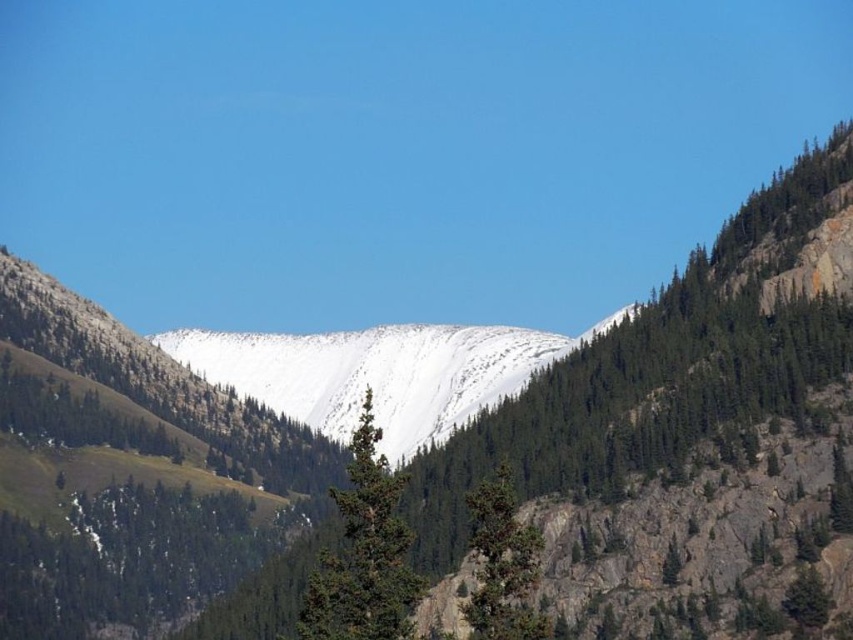
You are standing at the base of the mountain and looking towards the snow covered peak. There is a green textured tree at center. Where is the green textured tree located in relation to the snow covered peak?

The green textured tree at center is located at coordinates point (364, 554) in relation to the snow covered peak.

You are an environmental scientist assessing the mountain ecosystem. You observe the white matte snow at center and the green rough bark tree at center. Which object occupies a greater area in the scene?

The white matte snow at center is larger in size than the green rough bark tree at center, so it occupies a greater area in the scene.

You are a hiker planning to reach the snow covered peak. You have two possible paths marked by two points on your map. The first path leads from point (361, 445) to the peak, and the second path leads from point (498, 637) to the peak. Based on the spatial relationship between the two points, which path would be closer to the peak?

Point (361, 445) is behind point (498, 637), so the path from point (361, 445) to the peak would be closer to the peak since it is positioned further back towards the mountain.